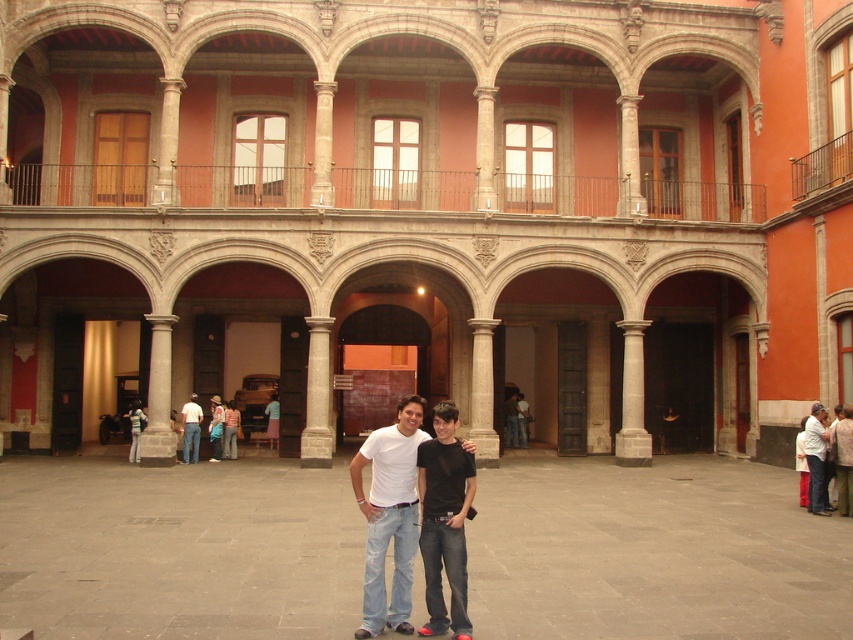
You are a photographer trying to capture the two people in the courtyard. Since you want to focus on the person wearing the black cotton shirt at center, which object should you place to the left of the denim jacket at center in your photo?

The black cotton shirt at center is positioned on the right side of the denim jacket at center, so to focus on the person wearing the black cotton shirt at center, you should place the denim jacket at center to the left of the black cotton shirt at center in your photo.

You are a photographer setting up for a group photo in the courtyard. You notice the black cotton shirt at center and the denim jacket at center. Which clothing item is positioned higher on the person?

The black cotton shirt at center is positioned higher because it is above the denim jacket at center.